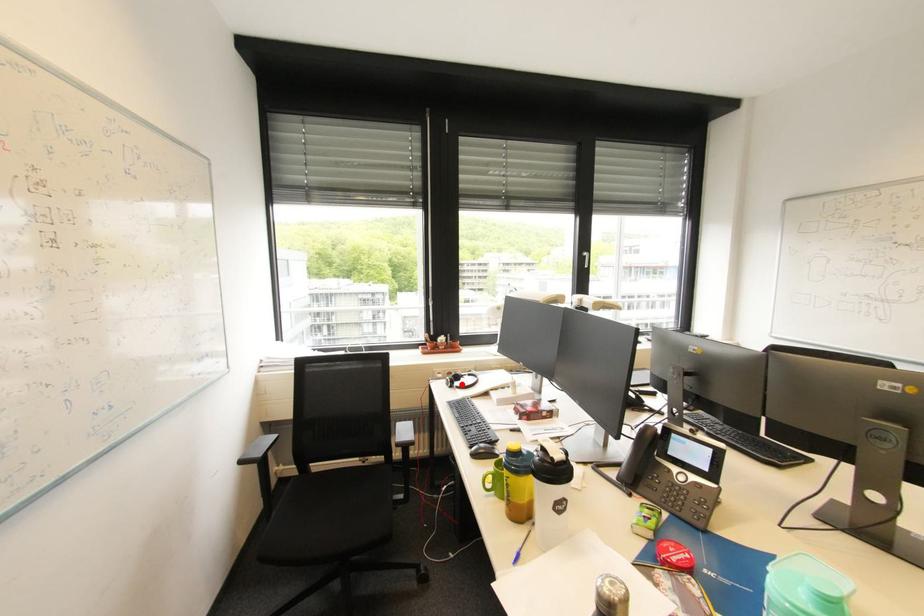
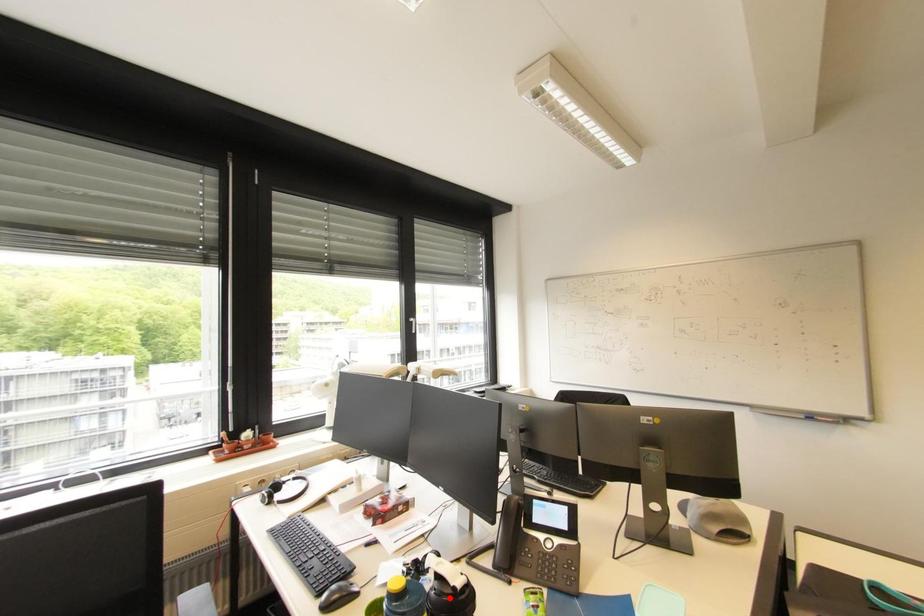
I am providing you with two images of the same scene from different viewpoints. A red point is marked on the first image and another point is marked on the second image. Are the points marked in image1 and image2 representing the same 3D position?

No